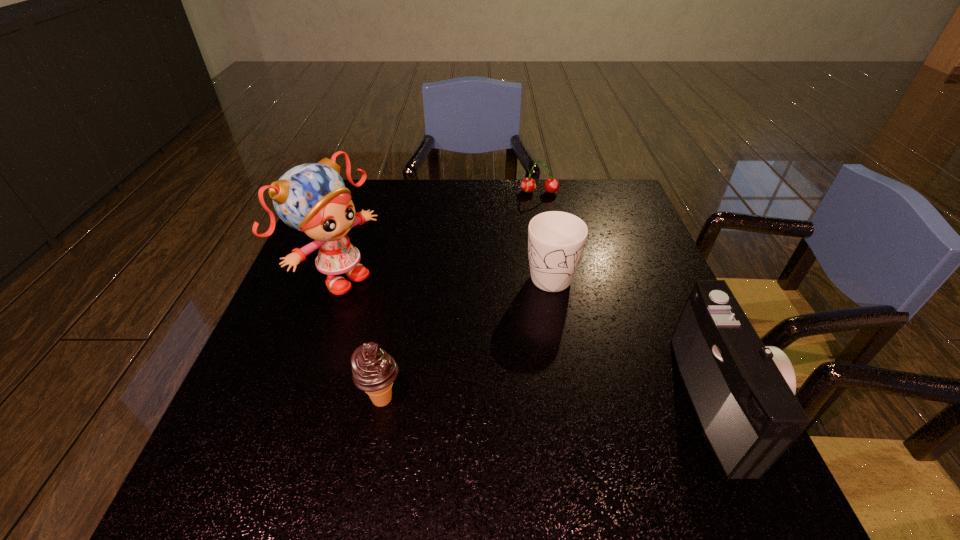
What are the coordinates of `icecream` in the screenshot? It's located at (373, 370).

Locate an element on the screen. The width and height of the screenshot is (960, 540). the rightmost object is located at coordinates (743, 393).

Locate an element on the screen. The width and height of the screenshot is (960, 540). mug is located at coordinates (556, 240).

The height and width of the screenshot is (540, 960). Find the location of `the leftmost object`. the leftmost object is located at coordinates (312, 198).

Locate an element on the screen. This screenshot has height=540, width=960. the tallest object is located at coordinates (312, 198).

Identify the location of the farthest object. The image size is (960, 540). (528, 185).

You are a GUI agent. You are given a task and a screenshot of the screen. Output one action in this format:
    pyautogui.click(x=<x>, y=<y>)
    Task: Click on the cherry
    Image resolution: width=960 pixels, height=540 pixels.
    Given the screenshot: What is the action you would take?
    pyautogui.click(x=528, y=185)

At what (x,y) coordinates should I click in order to perform the action: click on vacant point located 0.380m on the back of the second object from left to right. Please return your answer as a coordinate pair (x, y). Image resolution: width=960 pixels, height=540 pixels. Looking at the image, I should click on (408, 260).

Where is `vacant space situated 0.340m on the side of the mug with the handle`? This screenshot has height=540, width=960. vacant space situated 0.340m on the side of the mug with the handle is located at coordinates (579, 431).

Image resolution: width=960 pixels, height=540 pixels. In order to click on vacant space located 0.160m on the side of the mug with the handle in this screenshot , I will do `click(564, 352)`.